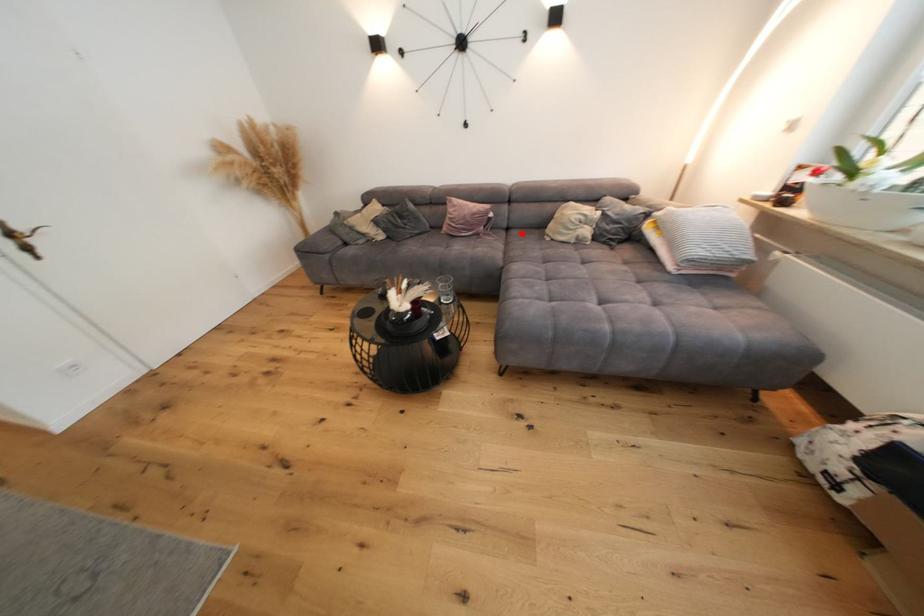
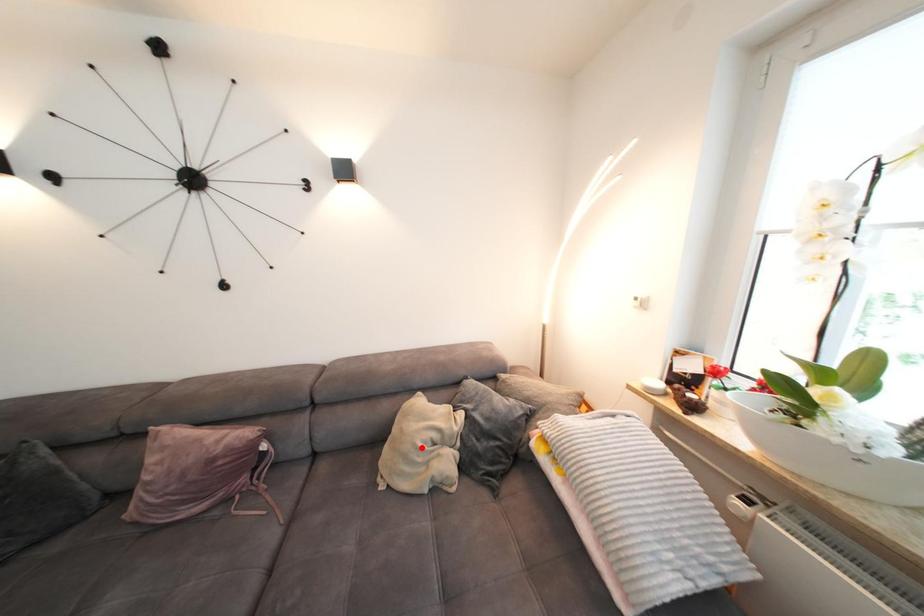
I am providing you with two images of the same scene from different viewpoints. A red point is marked on the first image and another point is marked on the second image. Is the red point in image1 aligned with the point shown in image2?

No